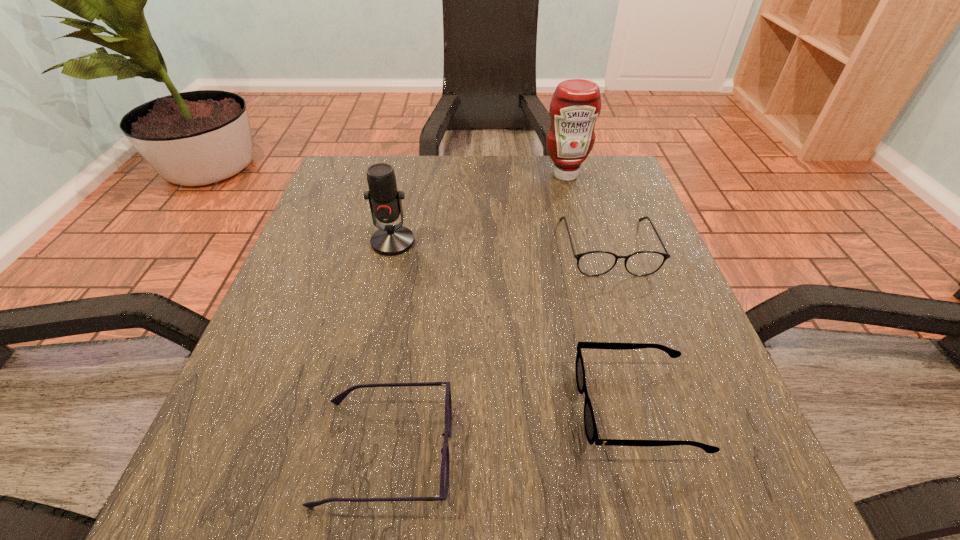
The height and width of the screenshot is (540, 960). I want to click on empty space between the leftmost spectacles and the farthest spectacles, so click(496, 349).

Where is `vacant point located between the tallest object and the microphone`? This screenshot has height=540, width=960. vacant point located between the tallest object and the microphone is located at coordinates (479, 208).

Find the location of a particular element. free space between the tallest object and the farthest spectacles is located at coordinates (587, 211).

Identify the location of vacant space that's between the farthest spectacles and the leftmost spectacles. The height and width of the screenshot is (540, 960). (496, 349).

Find the location of a particular element. This screenshot has height=540, width=960. object that is the fourth nearest to the fourth shortest object is located at coordinates [x=591, y=432].

Locate an element on the screen. This screenshot has width=960, height=540. object that ranks as the closest to the farthest spectacles is located at coordinates (576, 104).

Where is `spectacles that is the second closest to the fourth shortest object`? This screenshot has height=540, width=960. spectacles that is the second closest to the fourth shortest object is located at coordinates (445, 461).

I want to click on the second closest spectacles relative to the farthest spectacles, so click(445, 461).

Find the location of `free space that satisfies the following two spatial constraints: 1. on the front-facing side of the farthest spectacles; 2. on the front-facing side of the leftmost spectacles`. free space that satisfies the following two spatial constraints: 1. on the front-facing side of the farthest spectacles; 2. on the front-facing side of the leftmost spectacles is located at coordinates (673, 452).

Find the location of a particular element. This screenshot has height=540, width=960. free space that satisfies the following two spatial constraints: 1. on the front-facing side of the farthest spectacles; 2. on the front-facing side of the leftmost spectacles is located at coordinates (673, 452).